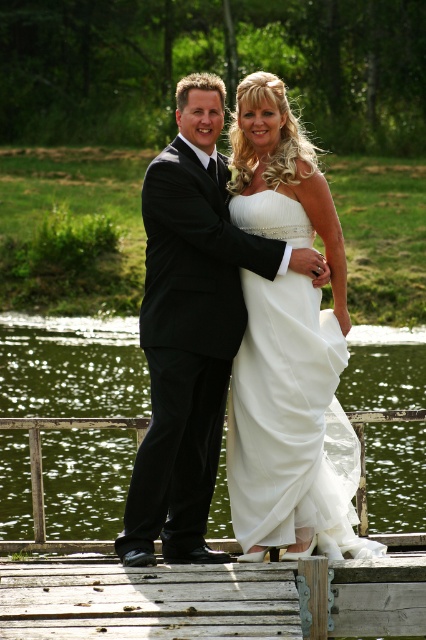
Question: Observing the image, what is the correct spatial positioning of matte black suit at center in reference to white satin dress at center?

Choices:
 (A) left
 (B) right

Answer: (B)

Question: Which point is closer to the camera?

Choices:
 (A) white satin dress at center
 (B) wooden at center
 (C) matte black suit at center

Answer: (B)

Question: Which object is closer to the camera taking this photo?

Choices:
 (A) wooden at center
 (B) green liquid water at center
 (C) white satin dress at center
 (D) matte black suit at center

Answer: (A)

Question: Can you confirm if white satin dress at center is positioned to the right of wooden at center?

Choices:
 (A) no
 (B) yes

Answer: (B)

Question: From the image, what is the correct spatial relationship of matte black suit at center in relation to wooden at center?

Choices:
 (A) above
 (B) below

Answer: (A)

Question: Which is farther from the green liquid water at center?

Choices:
 (A) matte black suit at center
 (B) wooden at center

Answer: (A)